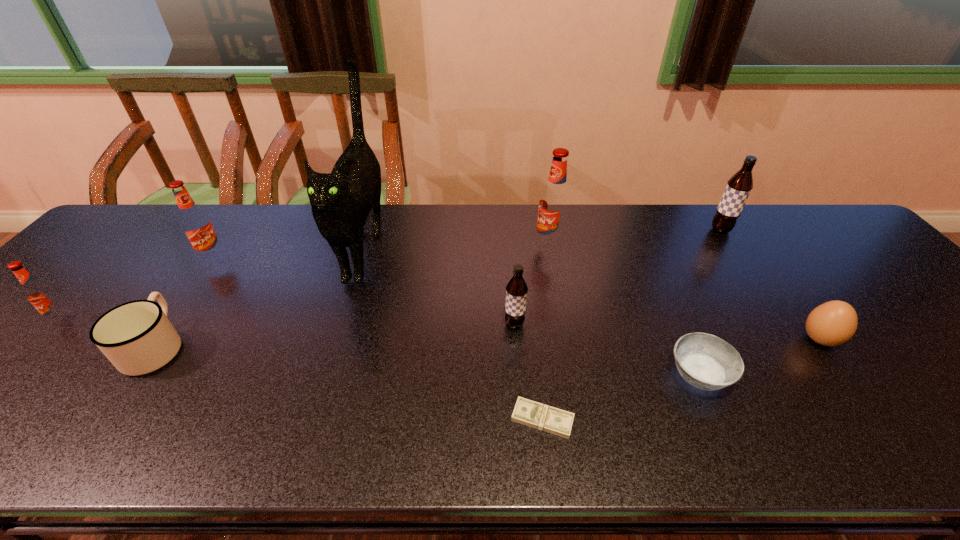
The image size is (960, 540). In order to click on free point between the leftmost object and the cat in this screenshot , I will do `click(214, 284)`.

This screenshot has height=540, width=960. I want to click on free space between the boiled egg and the leftmost object, so click(442, 330).

Identify the location of empty space between the second root beer from left to right and the cat. This screenshot has height=540, width=960. (289, 253).

Where is `free space between the nearest red root beer and the brown boiled egg`? This screenshot has width=960, height=540. free space between the nearest red root beer and the brown boiled egg is located at coordinates (442, 330).

Identify the location of empty space that is in between the leftmost red root beer and the nearer brown root beer. The height and width of the screenshot is (540, 960). (289, 322).

Identify the location of unoccupied position between the leftmost red root beer and the second red root beer from right to left. Image resolution: width=960 pixels, height=540 pixels. (138, 289).

Identify the location of empty space that is in between the farthest root beer and the second root beer from right to left. The width and height of the screenshot is (960, 540). (635, 238).

At what (x,y) coordinates should I click in order to perform the action: click on object that is the ninth nearest to the mug. Please return your answer as a coordinate pair (x, y). The width and height of the screenshot is (960, 540). Looking at the image, I should click on (833, 323).

I want to click on object that is the fourth closest to the second root beer from left to right, so click(516, 290).

Identify which root beer is the nearest to the boiled egg. Please provide its 2D coordinates. Your answer should be formatted as a tuple, i.e. [(x, y)], where the tuple contains the x and y coordinates of a point satisfying the conditions above.

[(739, 186)]